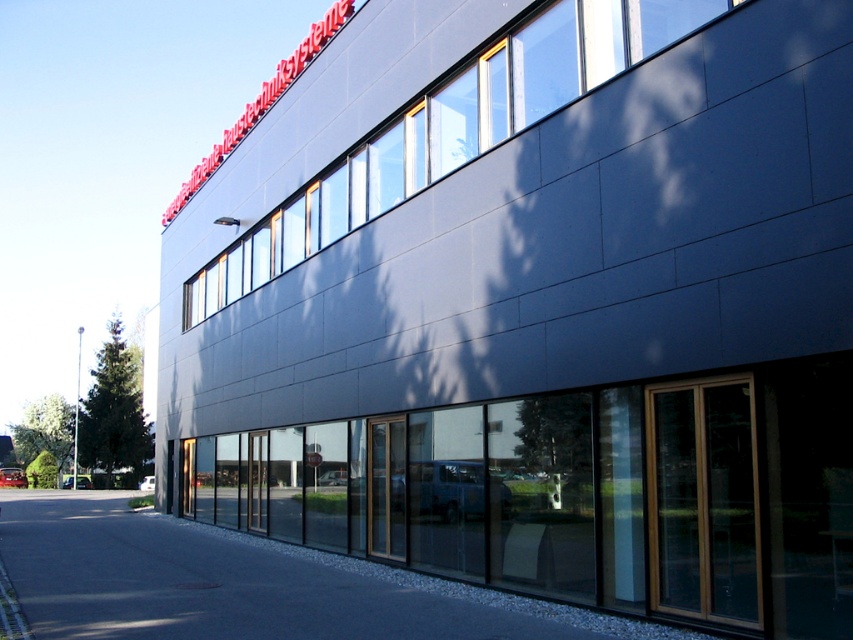
You are a delivery person approaching the building and need to park your van. The van requires a space that is to the left of the slate gray glass windows at upper center. Is the gray asphalt pavement at lower center a suitable parking spot?

The gray asphalt pavement at lower center is positioned on the left side of the slate gray glass windows at upper center, so it is a suitable parking spot to the left of the windows.

You are standing at the point labeled point (244, 582) in the image. What material are you standing on?

The point (244, 582) corresponds to gray asphalt pavement at lower center, so you are standing on asphalt.

You are a delivery driver who needs to park your truck, which is 6 meters long, in front of the building. The parking space available is between the gray asphalt pavement at lower center and the slate gray glass windows at upper center. Can your truck fit entirely within this space?

The distance between the gray asphalt pavement at lower center and the slate gray glass windows at upper center is 6.58 meters. Since the truck is 6 meters long, it can fit within the 6.58 meter space.